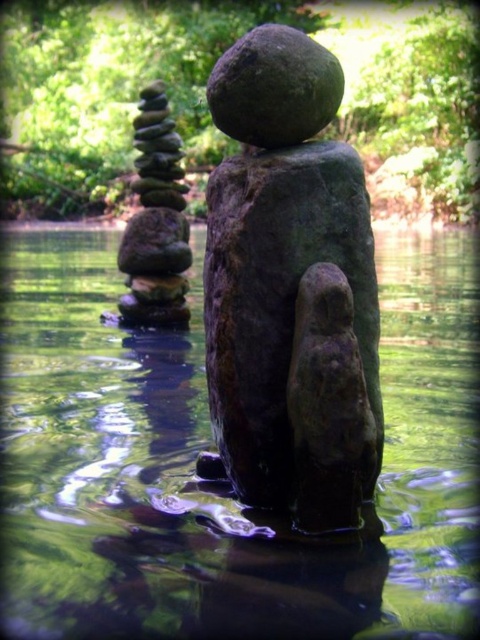
You are standing in the serene outdoor scene described. You want to place a small decorative rock exactly at the coordinates mentioned for the green reflective water at center. Is this possible?

The green reflective water at center is located at point (205, 449), so placing the rock there would place it in the water, which is possible as long as the water is deep enough. However, the description does not provide information about the water depth at that point.

You are standing on the bank of the pond and want to cross to the other side. You have two options to step on the green reflective water at center or the smooth gray stones at left. Which option is safer to step on?

The green reflective water at center has a lesser height compared to smooth gray stones at left, so stepping on the smooth gray stones at left would be safer as they are higher and less likely to be submerged.